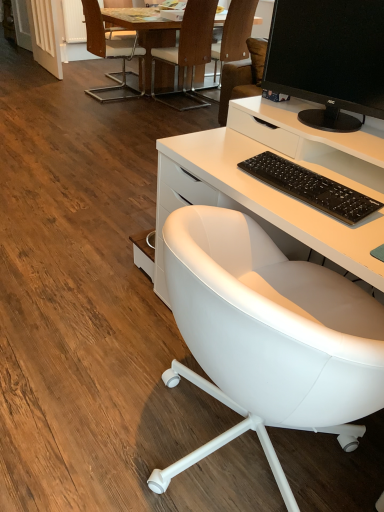
Question: Can you confirm if white leather chair at center, the fourth chair in the back-to-front sequence, is smaller than wooden table at upper center?

Choices:
 (A) no
 (B) yes

Answer: (B)

Question: Is white leather chair at center, the fourth chair in the back-to-front sequence, positioned in front of wooden table at upper center?

Choices:
 (A) no
 (B) yes

Answer: (B)

Question: Is white leather chair at center, which is the 1th chair from front to back, oriented away from wooden table at upper center?

Choices:
 (A) no
 (B) yes

Answer: (A)

Question: Does white leather chair at center, the fourth chair in the back-to-front sequence, appear on the left side of wooden table at upper center?

Choices:
 (A) no
 (B) yes

Answer: (A)

Question: Is there a large distance between white leather chair at center, which is the 1th chair from front to back, and wooden table at upper center?

Choices:
 (A) no
 (B) yes

Answer: (B)

Question: From the image's perspective, is wooden table at upper center above or below brown leather chair at upper center, the fourth chair viewed from the front?

Choices:
 (A) below
 (B) above

Answer: (B)

Question: From a real-world perspective, is wooden table at upper center positioned above or below brown leather chair at upper center, the fourth chair viewed from the front?

Choices:
 (A) above
 (B) below

Answer: (B)

Question: Based on their positions, is wooden table at upper center located to the left or right of brown leather chair at upper center, placed as the 1th chair when sorted from back to front?

Choices:
 (A) right
 (B) left

Answer: (B)

Question: In terms of size, does wooden table at upper center appear bigger or smaller than brown leather chair at upper center, the fourth chair viewed from the front?

Choices:
 (A) small
 (B) big

Answer: (B)

Question: Considering their positions, is brown leather chair at upper center, placed as the 1th chair when sorted from back to front, located in front of or behind wooden table at upper center?

Choices:
 (A) front
 (B) behind

Answer: (B)

Question: From the image's perspective, is brown leather chair at upper center, the fourth chair viewed from the front, positioned above or below wooden table at upper center?

Choices:
 (A) below
 (B) above

Answer: (A)

Question: Is brown leather chair at upper center, placed as the 1th chair when sorted from back to front, to the left or to the right of wooden table at upper center in the image?

Choices:
 (A) right
 (B) left

Answer: (A)

Question: Considering the positions of brown leather chair at upper center, placed as the 1th chair when sorted from back to front, and wooden table at upper center in the image, is brown leather chair at upper center, placed as the 1th chair when sorted from back to front, wider or thinner than wooden table at upper center?

Choices:
 (A) thin
 (B) wide

Answer: (A)

Question: Considering the positions of wooden chair at upper center, which is the 3th chair in back-to-front order, and wooden chair at upper left, the third chair in the front-to-back sequence, in the image, is wooden chair at upper center, which is the 3th chair in back-to-front order, bigger or smaller than wooden chair at upper left, the third chair in the front-to-back sequence,?

Choices:
 (A) small
 (B) big

Answer: (A)

Question: From the image's perspective, is wooden chair at upper center, which appears as the second chair when viewed from the front, positioned above or below wooden chair at upper left, the second chair viewed from the back?

Choices:
 (A) above
 (B) below

Answer: (B)